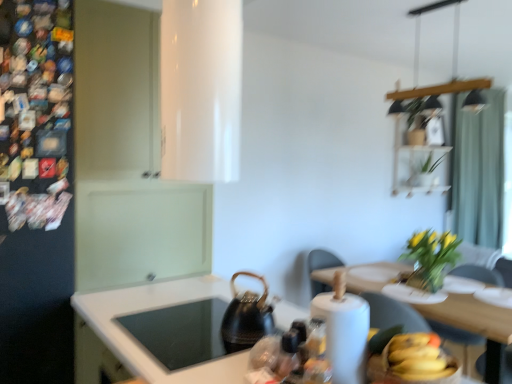
Measure the distance between teal fabric curtain at upper right and camera.

teal fabric curtain at upper right is 3.62 meters away from camera.

You are a GUI agent. You are given a task and a screenshot of the screen. Output one action in this format:
    pyautogui.click(x=<x>, y=<y>)
    Task: Click on the white glossy sink at lower center
    Image resolution: width=512 pixels, height=384 pixels.
    Given the screenshot: What is the action you would take?
    pyautogui.click(x=202, y=328)

At what (x,y) coordinates should I click in order to perform the action: click on yellow matte bananas at lower right. Please return your answer as a coordinate pair (x, y). Image resolution: width=512 pixels, height=384 pixels. Looking at the image, I should click on click(x=417, y=357).

Describe the element at coordinates (425, 172) in the screenshot. The width and height of the screenshot is (512, 384). I see `green matte plant at upper right, the 2th plant positioned from the front` at that location.

What is the approximate width of black matte refrigerator at left?

black matte refrigerator at left is 25.96 inches wide.

This screenshot has width=512, height=384. I want to click on black matte refrigerator at left, so click(36, 194).

This screenshot has height=384, width=512. In order to click on light brown wooden chair at right in this screenshot , I will do `click(457, 337)`.

Could you tell me if yellow matte bananas at lower right is facing green matte plant at upper right, which is counted as the first plant, starting from the back?

No, yellow matte bananas at lower right is not turned towards green matte plant at upper right, which is counted as the first plant, starting from the back.

Which object is more forward, yellow matte bananas at lower right or green matte plant at upper right, marked as the second plant in a bottom-to-top arrangement?

yellow matte bananas at lower right is more forward.

Considering the sizes of objects yellow matte bananas at lower right and green matte plant at upper right, the 1th plant from the right, in the image provided, who is taller, yellow matte bananas at lower right or green matte plant at upper right, the 1th plant from the right,?

green matte plant at upper right, the 1th plant from the right, is taller.

Measure the distance between yellow-green leaves at upper right, arranged as the second plant when viewed from the right, and black matte refrigerator at left.

A distance of 7.51 feet exists between yellow-green leaves at upper right, arranged as the second plant when viewed from the right, and black matte refrigerator at left.

Is yellow-green leaves at upper right, arranged as the 1th plant when viewed from the left, shorter than black matte refrigerator at left?

Correct, yellow-green leaves at upper right, arranged as the 1th plant when viewed from the left, is not as tall as black matte refrigerator at left.

Can you confirm if yellow-green leaves at upper right, which is counted as the second plant, starting from the top, is wider than black matte refrigerator at left?

In fact, yellow-green leaves at upper right, which is counted as the second plant, starting from the top, might be narrower than black matte refrigerator at left.

Which point is more distant from viewer, [418,249] or [65,69]?

The point [418,249] is more distant.

From the image's perspective, which object appears higher, black textured kettle at center or white paper towel at lower right?

white paper towel at lower right is shown above in the image.

Considering the sizes of objects black textured kettle at center and white paper towel at lower right in the image provided, who is taller, black textured kettle at center or white paper towel at lower right?

white paper towel at lower right.

From a real-world perspective, relative to white paper towel at lower right, is black textured kettle at center vertically above or below?

black textured kettle at center is situated lower than white paper towel at lower right in the real world.

From a real-world perspective, does black textured kettle at center stand above yellow matte bananas at lower right?

Correct, in the physical world, black textured kettle at center is higher than yellow matte bananas at lower right.

Does black textured kettle at center have a larger size compared to yellow matte bananas at lower right?

Correct, black textured kettle at center is larger in size than yellow matte bananas at lower right.

Which object is positioned more to the right, black textured kettle at center or yellow matte bananas at lower right?

Positioned to the right is yellow matte bananas at lower right.

Does wooden dining table at lower right have a smaller size compared to yellow-green leaves at upper right, which is counted as the second plant, starting from the top?

No.

In the scene shown: From their relative heights in the image, would you say wooden dining table at lower right is taller or shorter than yellow-green leaves at upper right, the second plant from the back?

Considering their sizes, wooden dining table at lower right has more height than yellow-green leaves at upper right, the second plant from the back.

Do you think wooden dining table at lower right is within yellow-green leaves at upper right, the second plant from the back, or outside of it?

wooden dining table at lower right is outside yellow-green leaves at upper right, the second plant from the back.

Which object is positioned more to the right, wooden dining table at lower right or yellow-green leaves at upper right, arranged as the 1th plant when viewed from the left?

yellow-green leaves at upper right, arranged as the 1th plant when viewed from the left.

Is yellow-green leaves at upper right, the 1th plant in the front-to-back sequence, completely or partially outside of white glossy countertop at lower center?

Yes, yellow-green leaves at upper right, the 1th plant in the front-to-back sequence, is outside of white glossy countertop at lower center.

From the image's perspective, is yellow-green leaves at upper right, which is counted as the second plant, starting from the top, above white glossy countertop at lower center?

Yes.

Is yellow-green leaves at upper right, acting as the 1th plant starting from the bottom, at the right side of white glossy countertop at lower center?

Indeed, yellow-green leaves at upper right, acting as the 1th plant starting from the bottom, is positioned on the right side of white glossy countertop at lower center.

Is yellow-green leaves at upper right, acting as the 1th plant starting from the bottom, further to camera compared to white glossy countertop at lower center?

That is True.

Which of these two, white paper towel at lower right or yellow-green leaves at upper right, the 1th plant in the front-to-back sequence, is smaller?

white paper towel at lower right is smaller.

Is white paper towel at lower right beside yellow-green leaves at upper right, arranged as the 1th plant when viewed from the left?

white paper towel at lower right is not next to yellow-green leaves at upper right, arranged as the 1th plant when viewed from the left, and they're not touching.

From the image's perspective, is white paper towel at lower right under yellow-green leaves at upper right, arranged as the second plant when viewed from the right?

No, from the image's perspective, white paper towel at lower right is not beneath yellow-green leaves at upper right, arranged as the second plant when viewed from the right.

Which object is thinner, white paper towel at lower right or yellow-green leaves at upper right, the second plant from the back?

white paper towel at lower right is thinner.

Locate an element on the screen. plant that is the 2nd object to the right of the yellow matte bananas at lower right, starting at the anchor is located at coordinates (425, 172).

You are a GUI agent. You are given a task and a screenshot of the screen. Output one action in this format:
    pyautogui.click(x=<x>, y=<y>)
    Task: Click on the plant below the black matte refrigerator at left (from the image's perspective)
    This screenshot has height=384, width=512.
    Given the screenshot: What is the action you would take?
    pyautogui.click(x=431, y=258)

From the image, which object appears to be nearer to teal fabric curtain at upper right, black textured kettle at center or black matte refrigerator at left?

black textured kettle at center is closer to teal fabric curtain at upper right.

Consider the image. When comparing their distances from yellow-green leaves at upper right, arranged as the second plant when viewed from the right, does white glossy countertop at lower center or black matte refrigerator at left seem closer?

white glossy countertop at lower center lies closer to yellow-green leaves at upper right, arranged as the second plant when viewed from the right, than the other object.

Based on their spatial positions, is yellow matte bananas at lower right or black matte refrigerator at left closer to yellow-green leaves at upper right, the 1th plant in the front-to-back sequence?

yellow matte bananas at lower right is closer to yellow-green leaves at upper right, the 1th plant in the front-to-back sequence.

Looking at the image, which one is located further to light brown wooden chair at right, black textured kettle at center or green matte plant at upper right, marked as the second plant in a bottom-to-top arrangement?

Among the two, green matte plant at upper right, marked as the second plant in a bottom-to-top arrangement, is located further to light brown wooden chair at right.

From the image, which object appears to be nearer to green matte plant at upper right, marked as the second plant in a bottom-to-top arrangement, yellow-green leaves at upper right, the 1th plant in the front-to-back sequence, or black textured kettle at center?

yellow-green leaves at upper right, the 1th plant in the front-to-back sequence, lies closer to green matte plant at upper right, marked as the second plant in a bottom-to-top arrangement, than the other object.

From the image, which object appears to be farther from white glossy sink at lower center, black textured kettle at center or wooden dining table at lower right?

wooden dining table at lower right is further to white glossy sink at lower center.

Looking at the image, which one is located further to light brown wooden chair at right, green matte plant at upper right, the 2th plant from the left, or white glossy sink at lower center?

green matte plant at upper right, the 2th plant from the left, lies further to light brown wooden chair at right than the other object.

Which object lies nearer to the anchor point black textured kettle at center, light brown wooden chair at right or white glossy sink at lower center?

white glossy sink at lower center.

At what (x,y) coordinates should I click in order to perform the action: click on plant between black matte refrigerator at left and green matte plant at upper right, the 2th plant positioned from the front, in the horizontal direction. Please return your answer as a coordinate pair (x, y). Looking at the image, I should click on (431, 258).

What are the coordinates of `paper towel between white glossy countertop at lower center and wooden dining table at lower right` in the screenshot? It's located at (344, 334).

Image resolution: width=512 pixels, height=384 pixels. I want to click on tea pot located between black matte refrigerator at left and light brown wooden chair at right in the left-right direction, so click(x=246, y=317).

At what (x,y) coordinates should I click in order to perform the action: click on kitchen & dining room table located between white glossy countertop at lower center and green matte plant at upper right, the 2th plant positioned from the front, in the depth direction. Please return your answer as a coordinate pair (x, y). This screenshot has width=512, height=384. Looking at the image, I should click on (475, 323).